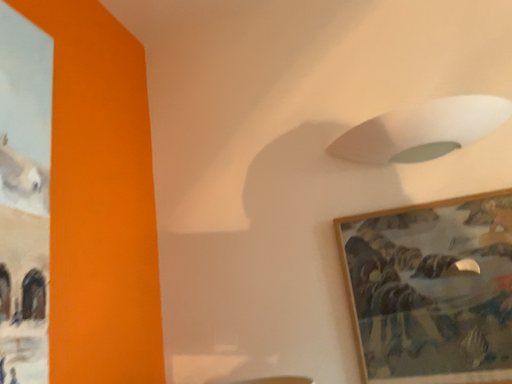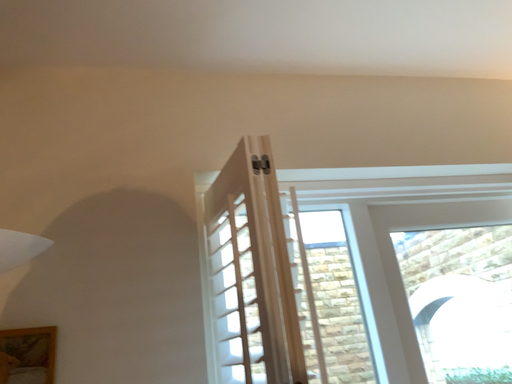
Question: Which way did the camera rotate in the video?

Choices:
 (A) rotated upward
 (B) rotated downward

Answer: (A)